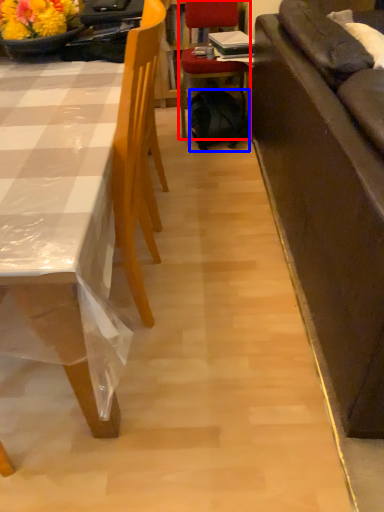
Question: Among these objects, which one is nearest to the camera, chair (highlighted by a red box) or backpack (highlighted by a blue box)?

Choices:
 (A) chair
 (B) backpack

Answer: (A)